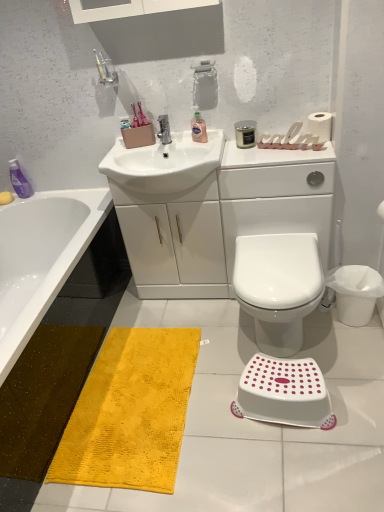
I want to click on unoccupied area in front of white plastic step stool at lower right, so click(x=303, y=465).